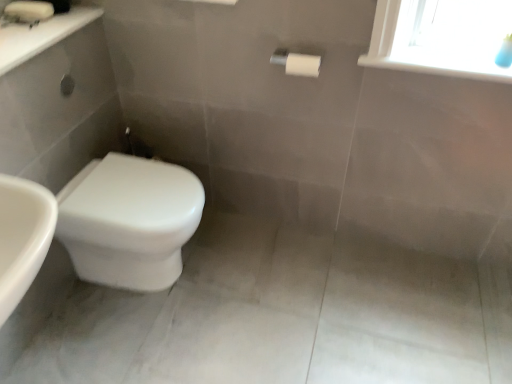
Locate an element on the screen. This screenshot has width=512, height=384. free point above white glossy toilet at lower left (from a real-world perspective) is located at coordinates (126, 188).